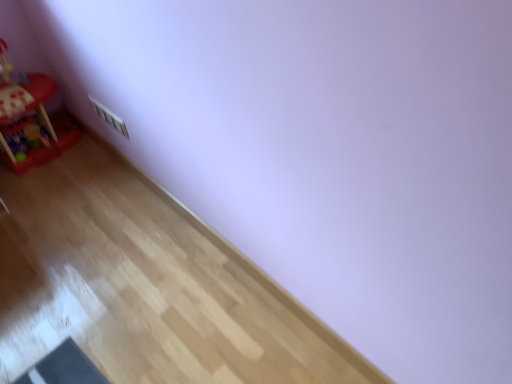
Image resolution: width=512 pixels, height=384 pixels. In order to click on free space in front of matte plastic toy at left in this screenshot , I will do `click(37, 191)`.